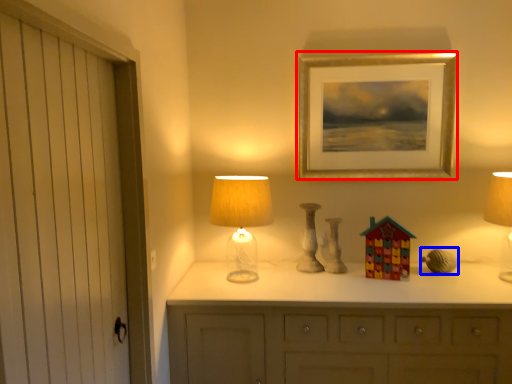
Question: Which of the following is the farthest to the observer, picture frame (highlighted by a red box) or miniature (highlighted by a blue box)?

Choices:
 (A) picture frame
 (B) miniature

Answer: (A)